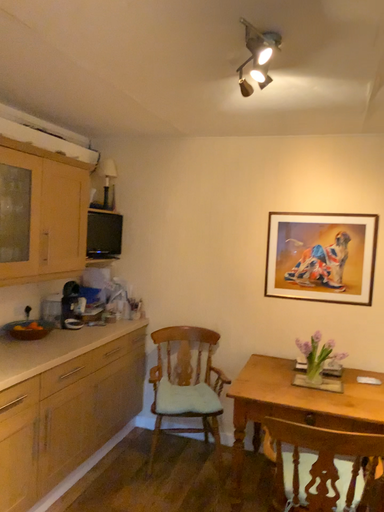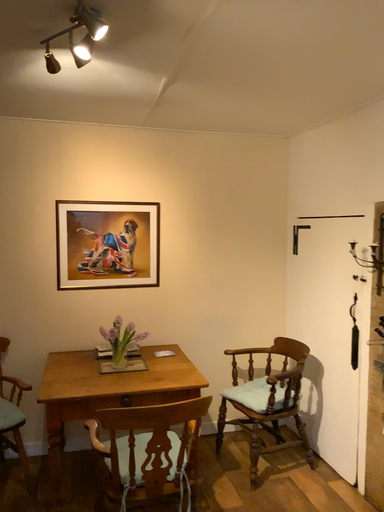
Question: Which way did the camera rotate in the video?

Choices:
 (A) rotated left
 (B) rotated right

Answer: (B)